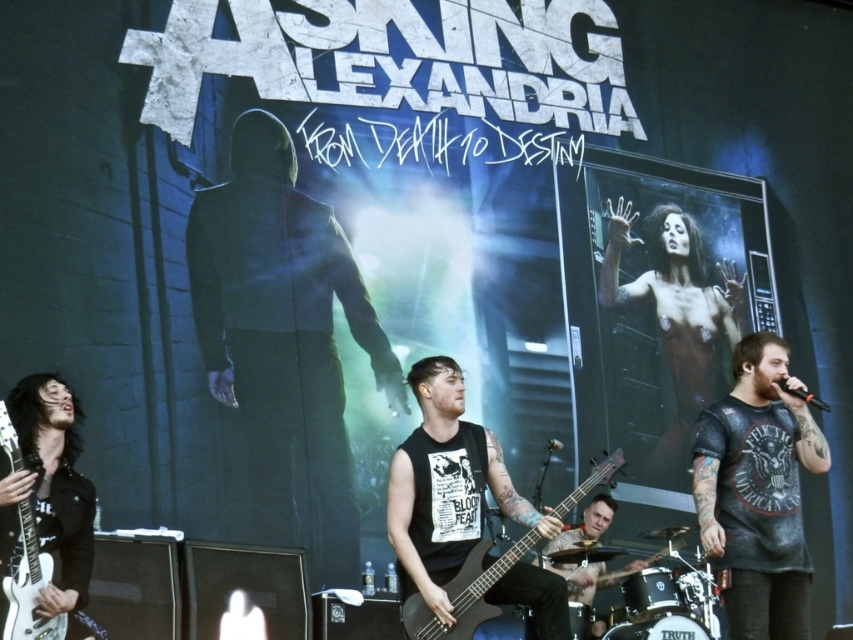
Question: Considering the relative positions of black matte bass guitar at center and white glossy electric guitar at left in the image provided, where is black matte bass guitar at center located with respect to white glossy electric guitar at left?

Choices:
 (A) right
 (B) left

Answer: (A)

Question: Which object is closer to the camera taking this photo?

Choices:
 (A) dark gray t-shirt at center
 (B) white glossy electric guitar at left
 (C) black matte bass guitar at center

Answer: (B)

Question: Considering the relative positions of black matte bass guitar at center and white glossy electric guitar at left in the image provided, where is black matte bass guitar at center located with respect to white glossy electric guitar at left?

Choices:
 (A) below
 (B) above

Answer: (B)

Question: Is dark matte hoodie at center to the left of white glossy electric guitar at left from the viewer's perspective?

Choices:
 (A) no
 (B) yes

Answer: (A)

Question: Which object appears farthest from the camera in this image?

Choices:
 (A) white glossy electric guitar at left
 (B) dark matte hoodie at center
 (C) black matte bass guitar at center
 (D) dark gray t-shirt at center

Answer: (B)

Question: Estimate the real-world distances between objects in this image. Which object is farther from the black matte bass guitar at center?

Choices:
 (A) dark gray t-shirt at center
 (B) white glossy electric guitar at left
 (C) dark matte hoodie at center

Answer: (B)